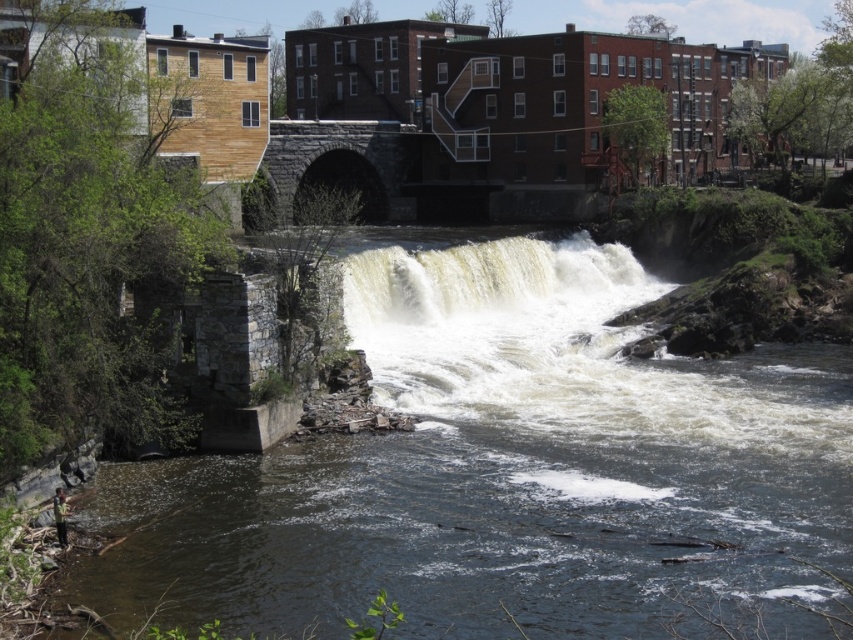
You are a kayaker preparing to navigate the river. You see the dark gray concrete river at lower left and the white frothy water at center. Which section of the river should you avoid to stay safe?

You should avoid the white frothy water at center because the dark gray concrete river at lower left is in front of it, indicating it is closer and calmer, while the frothy section likely has stronger currents or rapids that are more dangerous.

You are a delivery drone that needs to fly from the dark gray concrete river at lower left to the white frothy water at center. The drone has a minimum flight altitude requirement of 3 meters to avoid obstacles. Can you safely navigate this route without violating the altitude requirement?

The distance between the dark gray concrete river at lower left and the white frothy water at center is 3.37 meters. Since the drone requires a minimum altitude of 3 meters, it can safely navigate the route as the required altitude is met with a slight margin.